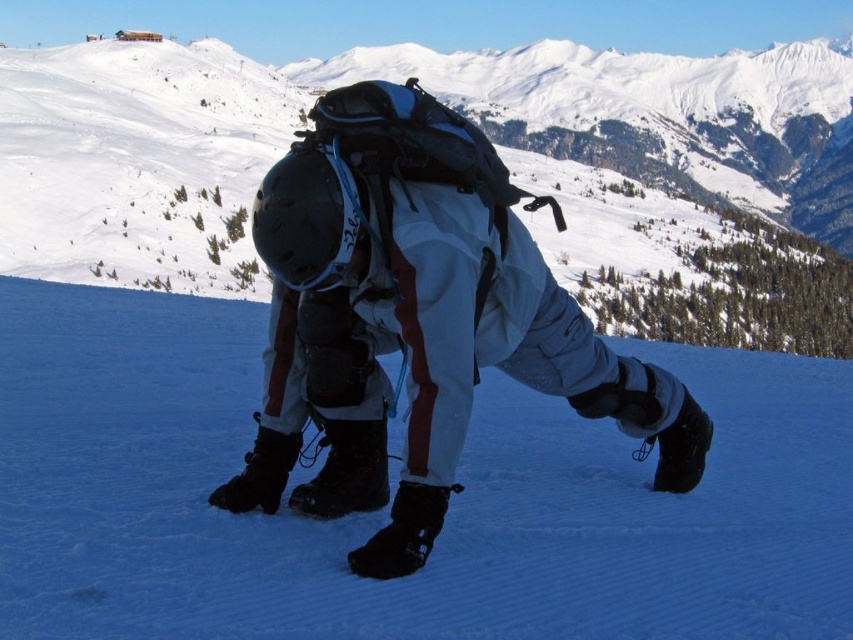
You are a photographer planning to take a photo of the white matte snowsuit at center and the white matte snow at center. Which object should you focus on first if you want to capture both in sharp focus?

The white matte snowsuit at center is above the white matte snow at center, so focusing on the snowsuit first will ensure both are in focus as the snow is below it.

You are standing at the bottom of the mountain and want to take a photo of the white matte snow at center and the white matte snowsuit at center. Which one will appear larger in the photo?

The white matte snow at center will appear larger in the photo because it is closer to the viewer than the white matte snowsuit at center.

You are planning to take a photo of the white matte snow at center and the white matte snowsuit at center. Which object will appear larger in the photo?

The white matte snowsuit at center will appear larger in the photo because it is taller than the white matte snow at center.